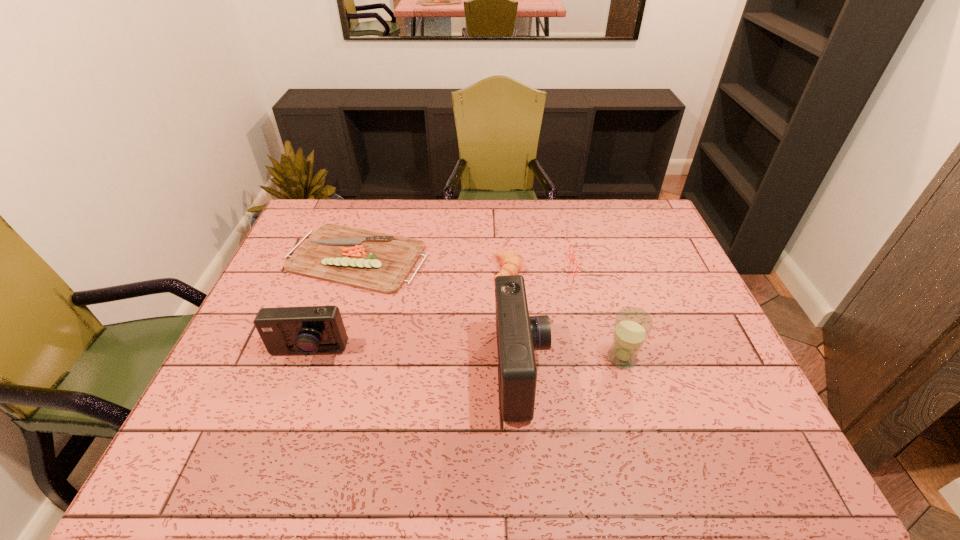
Where is `vacant space at the far edge of the desktop`? This screenshot has width=960, height=540. vacant space at the far edge of the desktop is located at coordinates (487, 215).

Image resolution: width=960 pixels, height=540 pixels. I want to click on vacant space at the near edge, so click(x=309, y=410).

This screenshot has width=960, height=540. Find the location of `vacant space at the left edge`. vacant space at the left edge is located at coordinates (261, 349).

Locate an element on the screen. blank space at the right edge is located at coordinates (666, 309).

The image size is (960, 540). I want to click on vacant space at the far left corner, so click(x=337, y=218).

The height and width of the screenshot is (540, 960). What are the coordinates of `free space at the near left corner` in the screenshot? It's located at (238, 418).

The image size is (960, 540). In order to click on vacant space at the near right corner of the desktop in this screenshot , I will do `click(703, 405)`.

Find the location of `free space between the crescent roll and the left camera`. free space between the crescent roll and the left camera is located at coordinates (407, 311).

What are the coordinates of `blank region between the tallest object and the shortest object` in the screenshot? It's located at (439, 314).

Find the location of a particular element. empty location between the shortest object and the crescent roll is located at coordinates (432, 264).